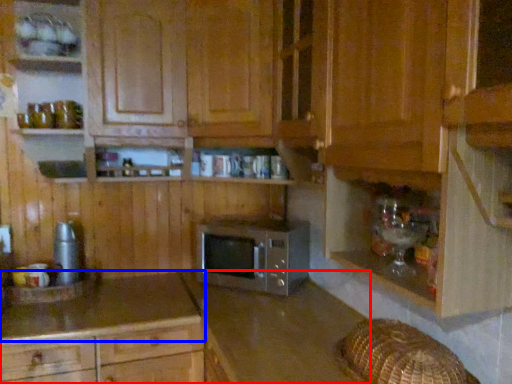
Question: Among these objects, which one is farthest to the camera, cabinetry (highlighted by a red box) or countertop (highlighted by a blue box)?

Choices:
 (A) cabinetry
 (B) countertop

Answer: (B)